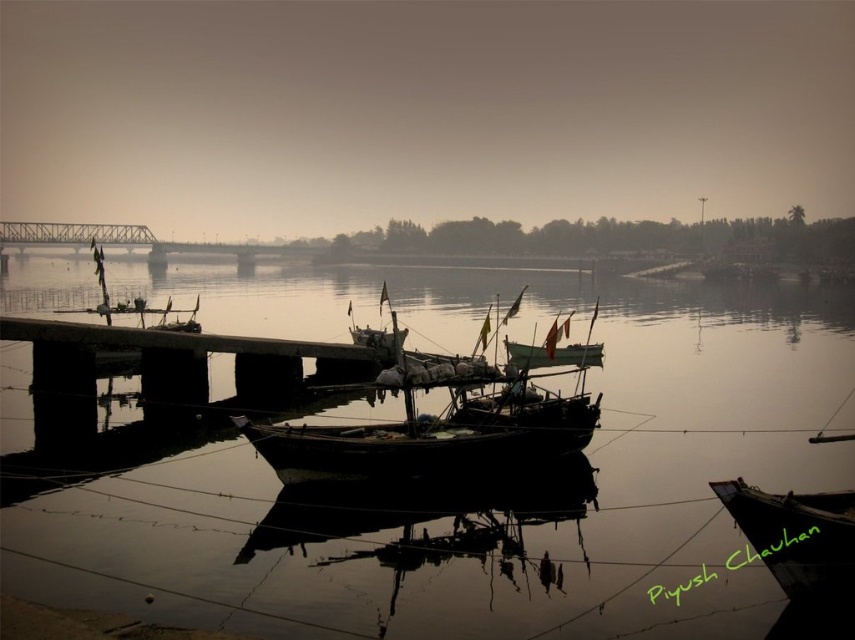
You are a photographer standing on the dock and want to capture the brown matte water at center and dark brown wooden boat at lower right in a single shot. Which object will appear larger in the photo?

The brown matte water at center will appear larger in the photo because it is much taller than the dark brown wooden boat at lower right.

You are a photographer planning to take a wide shot of the riverside scene. The camera can only capture objects that are larger than the dark brown wooden boat at lower right. Will the brown matte water at center be visible in your photo?

The brown matte water at center is bigger than the dark brown wooden boat at lower right, so yes, it will be visible in the photo as it meets the size requirement.

You are a fisherman planning to dock your boat at the riverside. You see two boats already there, a wooden boat at center and a green matte boat at center. Which boat has a wider deck for carrying more fishing gear?

The wooden boat at center has a wider deck than the green matte boat at center, so it can carry more fishing gear.